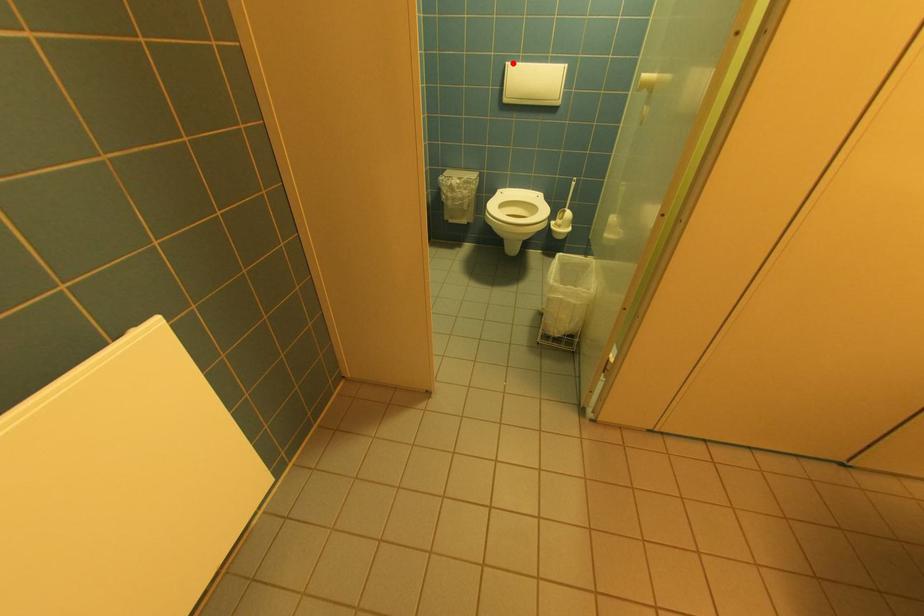
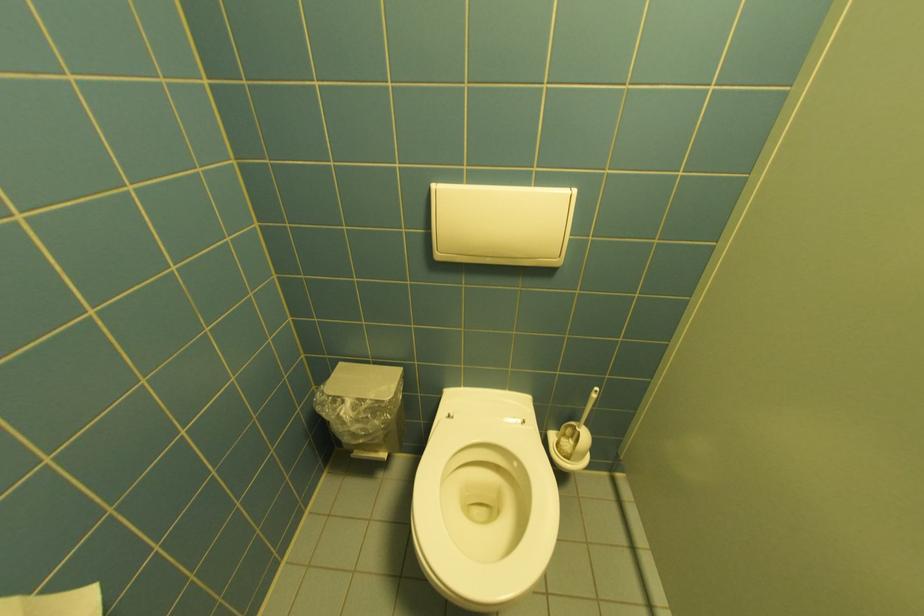
Locate, in the second image, the point that corresponds to the highlighted location in the first image.

(440, 185)